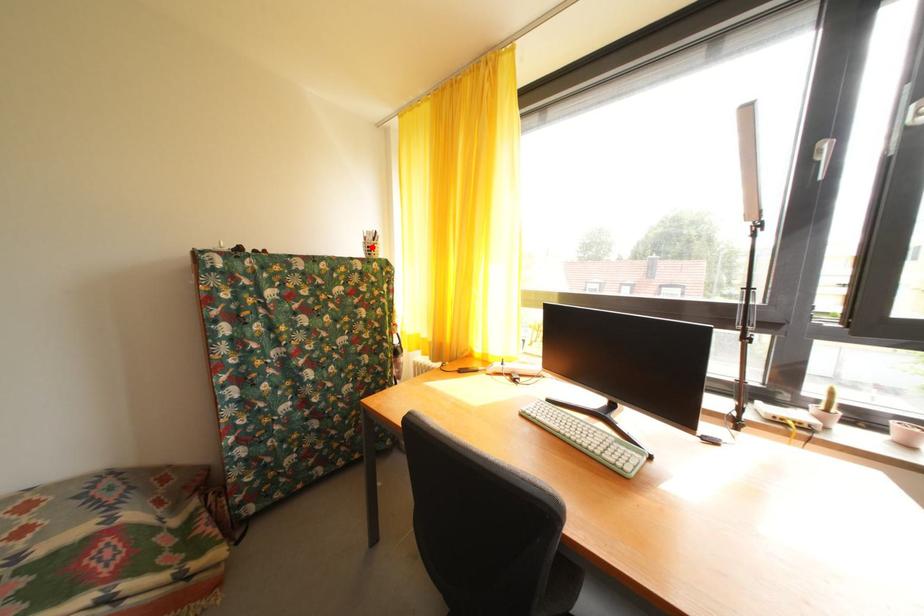
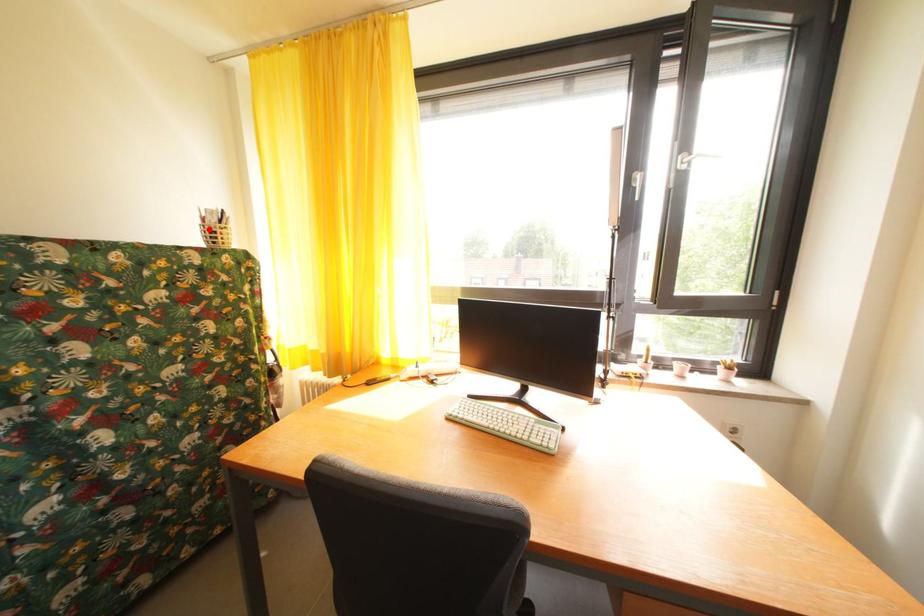
Based on the photo, I am providing you with two images of the same scene from different viewpoints. A red point is marked on the first image and another point is marked on the second image. Are the points marked in image1 and image2 representing the same 3D position?

Yes